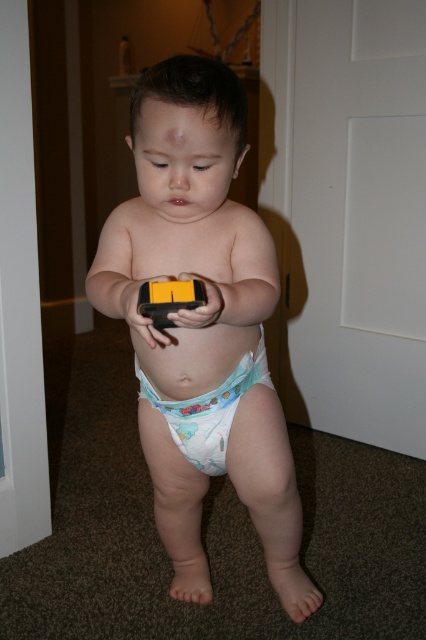
Question: Which point is farther to the camera?

Choices:
 (A) white cloth diaper at center
 (B) white fabric diaper at center
 (C) yellow plastic remote at center

Answer: (B)

Question: Is white cloth diaper at center below white fabric diaper at center?

Choices:
 (A) yes
 (B) no

Answer: (A)

Question: Which point is farther to the camera?

Choices:
 (A) white cloth diaper at center
 (B) yellow plastic remote at center
 (C) white fabric diaper at center

Answer: (C)

Question: Does white cloth diaper at center appear on the left side of white fabric diaper at center?

Choices:
 (A) no
 (B) yes

Answer: (B)

Question: Can you confirm if white fabric diaper at center is positioned below yellow plastic remote at center?

Choices:
 (A) no
 (B) yes

Answer: (B)

Question: Which of these objects is positioned farthest from the yellow plastic remote at center?

Choices:
 (A) white fabric diaper at center
 (B) white cloth diaper at center

Answer: (A)